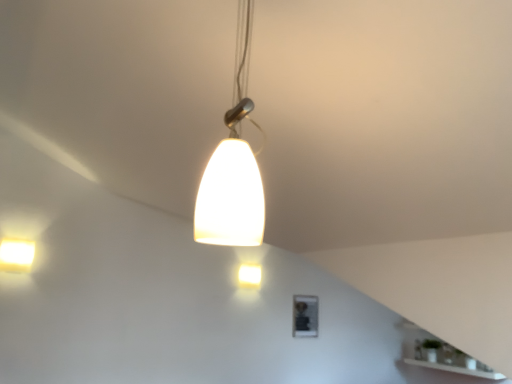
Where is `matte white light fixture at center, the 3th lamp viewed from the top`? The width and height of the screenshot is (512, 384). matte white light fixture at center, the 3th lamp viewed from the top is located at coordinates (250, 275).

The image size is (512, 384). Find the location of `matte white light fixture at upper left, the 2th lamp in the bottom-to-top sequence`. matte white light fixture at upper left, the 2th lamp in the bottom-to-top sequence is located at coordinates (16, 255).

Is matte white light fixture at center, acting as the 2th lamp starting from the right, positioned before matte white light fixture at upper left, marked as the 2th lamp in a top-to-bottom arrangement?

No, matte white light fixture at center, acting as the 2th lamp starting from the right, is further to the viewer.

You are a GUI agent. You are given a task and a screenshot of the screen. Output one action in this format:
    pyautogui.click(x=<x>, y=<y>)
    Task: Click on the 1st lamp directly above the matte white light fixture at center, which is counted as the 1th lamp, starting from the bottom (from a real-world perspective)
    
    Given the screenshot: What is the action you would take?
    pyautogui.click(x=16, y=255)

Who is bigger, matte white light fixture at center, placed as the first lamp when sorted from back to front, or matte white light fixture at upper left, positioned as the first lamp in left-to-right order?

With larger size is matte white light fixture at upper left, positioned as the first lamp in left-to-right order.

From a real-world perspective, is matte white light fixture at center, the 3th lamp viewed from the top, physically located above or below matte white light fixture at upper left, acting as the second lamp starting from the front?

Clearly, from a real-world perspective, matte white light fixture at center, the 3th lamp viewed from the top, is below matte white light fixture at upper left, acting as the second lamp starting from the front.

From the image's perspective, which is above, matte white pendant light at center, positioned as the 3th lamp in left-to-right order, or matte white light fixture at upper left, the 2th lamp in the bottom-to-top sequence?

matte white pendant light at center, positioned as the 3th lamp in left-to-right order, appears higher in the image.

How distant is matte white pendant light at center, arranged as the first lamp when viewed from the top, from matte white light fixture at upper left, placed as the 2th lamp when sorted from back to front?

9.34 feet.

How many degrees apart are the facing directions of matte white pendant light at center, placed as the first lamp when sorted from right to left, and matte white light fixture at upper left, the 3th lamp viewed from the right?

The facing directions of matte white pendant light at center, placed as the first lamp when sorted from right to left, and matte white light fixture at upper left, the 3th lamp viewed from the right, are 0.822 degrees apart.

From a real-world perspective, which is physically above, matte white pendant light at center, positioned as the 3th lamp in left-to-right order, or matte white light fixture at upper left, the 2th lamp in the bottom-to-top sequence?

From a 3D spatial view, matte white pendant light at center, positioned as the 3th lamp in left-to-right order, is above.

Considering the sizes of objects matte white light fixture at center, which is counted as the 1th lamp, starting from the bottom, and matte white pendant light at center, placed as the first lamp when sorted from right to left, in the image provided, who is bigger, matte white light fixture at center, which is counted as the 1th lamp, starting from the bottom, or matte white pendant light at center, placed as the first lamp when sorted from right to left,?

matte white pendant light at center, placed as the first lamp when sorted from right to left, is bigger.

Which object is wider, matte white light fixture at center, acting as the 2th lamp starting from the right, or matte white pendant light at center, positioned as the 3th lamp in left-to-right order?

With larger width is matte white pendant light at center, positioned as the 3th lamp in left-to-right order.

Which is in front, point (241, 282) or point (232, 212)?

The point (232, 212) is closer to the camera.

Is matte white light fixture at center, which is the second lamp from left to right, with matte white pendant light at center, positioned as the 3th lamp in left-to-right order?

No, matte white light fixture at center, which is the second lamp from left to right, is not next to matte white pendant light at center, positioned as the 3th lamp in left-to-right order.

Is point (213, 232) positioned behind point (257, 272)?

That is False.

Is matte white pendant light at center, placed as the first lamp when sorted from right to left, not within matte white light fixture at center, which is counted as the 1th lamp, starting from the bottom?

matte white pendant light at center, placed as the first lamp when sorted from right to left, lies outside matte white light fixture at center, which is counted as the 1th lamp, starting from the bottom,'s area.

Is matte white pendant light at center, placed as the first lamp when sorted from right to left, oriented away from matte white light fixture at center, which is the second lamp from left to right?

No.

Would you say matte white pendant light at center, the third lamp in the bottom-to-top sequence, is a long distance from matte white light fixture at center, placed as the third lamp when sorted from front to back?

Absolutely, matte white pendant light at center, the third lamp in the bottom-to-top sequence, is distant from matte white light fixture at center, placed as the third lamp when sorted from front to back.

In the scene shown: Between matte white light fixture at upper left, acting as the second lamp starting from the front, and matte white light fixture at center, which is counted as the 1th lamp, starting from the bottom, which one appears on the right side from the viewer's perspective?

Positioned to the right is matte white light fixture at center, which is counted as the 1th lamp, starting from the bottom.

Considering the positions of point (5, 258) and point (246, 279), is point (5, 258) closer or farther from the camera than point (246, 279)?

Point (5, 258).

Is matte white light fixture at upper left, the 3th lamp viewed from the right, turned away from matte white light fixture at center, which is counted as the 1th lamp, starting from the bottom?

No, matte white light fixture at center, which is counted as the 1th lamp, starting from the bottom, is not at the back of matte white light fixture at upper left, the 3th lamp viewed from the right.

Image resolution: width=512 pixels, height=384 pixels. What are the coordinates of `the 1st lamp in front when counting from the matte white light fixture at center, acting as the 2th lamp starting from the right` in the screenshot? It's located at (16, 255).

Which object is wider, matte white light fixture at upper left, positioned as the first lamp in left-to-right order, or matte white pendant light at center, which is the 3th lamp from back to front?

matte white pendant light at center, which is the 3th lamp from back to front.

Considering the relative positions of matte white light fixture at upper left, placed as the 2th lamp when sorted from back to front, and matte white pendant light at center, acting as the first lamp starting from the front, in the image provided, is matte white light fixture at upper left, placed as the 2th lamp when sorted from back to front, to the left or to the right of matte white pendant light at center, acting as the first lamp starting from the front,?

From the image, it's evident that matte white light fixture at upper left, placed as the 2th lamp when sorted from back to front, is to the left of matte white pendant light at center, acting as the first lamp starting from the front.

From their relative heights in the image, would you say matte white light fixture at upper left, positioned as the first lamp in left-to-right order, is taller or shorter than matte white pendant light at center, acting as the first lamp starting from the front?

matte white light fixture at upper left, positioned as the first lamp in left-to-right order, is shorter than matte white pendant light at center, acting as the first lamp starting from the front.

Identify the location of lamp above the matte white light fixture at upper left, acting as the second lamp starting from the front (from a real-world perspective). The image size is (512, 384). (233, 166).

Find the location of a particular element. This screenshot has height=384, width=512. the 1st lamp above the matte white light fixture at center, which is counted as the 1th lamp, starting from the bottom (from a real-world perspective) is located at coordinates (16, 255).

Starting from the matte white pendant light at center, positioned as the 3th lamp in left-to-right order, which lamp is the 1st one behind? Please provide its 2D coordinates.

[(16, 255)]

When comparing their distances from matte white light fixture at upper left, placed as the 2th lamp when sorted from back to front, does matte white pendant light at center, arranged as the first lamp when viewed from the top, or matte white light fixture at center, acting as the 2th lamp starting from the right, seem further?

Based on the image, matte white pendant light at center, arranged as the first lamp when viewed from the top, appears to be further to matte white light fixture at upper left, placed as the 2th lamp when sorted from back to front.

Estimate the real-world distances between objects in this image. Which object is further from matte white pendant light at center, placed as the first lamp when sorted from right to left, matte white light fixture at upper left, placed as the 2th lamp when sorted from back to front, or matte white light fixture at center, the 3th lamp viewed from the top?

matte white light fixture at center, the 3th lamp viewed from the top, is further to matte white pendant light at center, placed as the first lamp when sorted from right to left.

Looking at the image, which one is located closer to matte white light fixture at center, acting as the 2th lamp starting from the right, matte white light fixture at upper left, placed as the 2th lamp when sorted from back to front, or matte white pendant light at center, positioned as the 3th lamp in left-to-right order?

Among the two, matte white light fixture at upper left, placed as the 2th lamp when sorted from back to front, is located nearer to matte white light fixture at center, acting as the 2th lamp starting from the right.

Looking at this image, when comparing their distances from matte white light fixture at upper left, marked as the 2th lamp in a top-to-bottom arrangement, does matte white light fixture at center, acting as the 2th lamp starting from the right, or matte white pendant light at center, arranged as the first lamp when viewed from the top, seem closer?

Among the two, matte white light fixture at center, acting as the 2th lamp starting from the right, is located nearer to matte white light fixture at upper left, marked as the 2th lamp in a top-to-bottom arrangement.

When comparing their distances from matte white pendant light at center, which is the 3th lamp from back to front, does matte white light fixture at center, the 3th lamp viewed from the top, or matte white light fixture at upper left, placed as the 2th lamp when sorted from back to front, seem further?

matte white light fixture at center, the 3th lamp viewed from the top, lies further to matte white pendant light at center, which is the 3th lamp from back to front, than the other object.

Estimate the real-world distances between objects in this image. Which object is closer to matte white light fixture at center, which is the second lamp from left to right, matte white pendant light at center, the third lamp in the bottom-to-top sequence, or matte white light fixture at upper left, positioned as the first lamp in left-to-right order?

The object closer to matte white light fixture at center, which is the second lamp from left to right, is matte white light fixture at upper left, positioned as the first lamp in left-to-right order.

Identify the location of lamp positioned between matte white pendant light at center, acting as the first lamp starting from the front, and matte white light fixture at center, which is counted as the 1th lamp, starting from the bottom, from near to far. (16, 255).